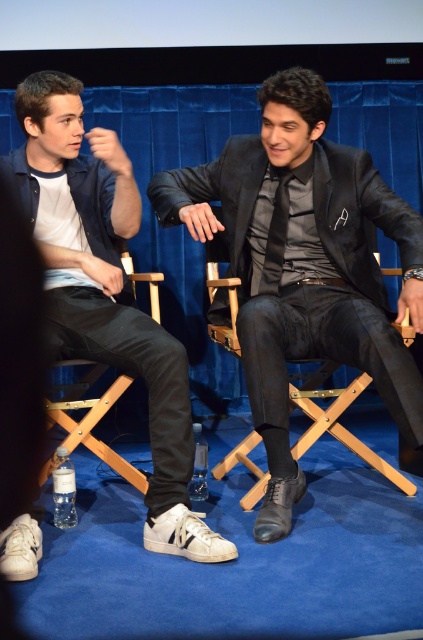
Between black leather shoes at center and silky black tie at center, which one appears on the left side from the viewer's perspective?

From the viewer's perspective, silky black tie at center appears more on the left side.

What do you see at coordinates (304, 268) in the screenshot? The height and width of the screenshot is (640, 423). I see `black leather shoes at center` at bounding box center [304, 268].

Locate an element on the screen. The height and width of the screenshot is (640, 423). black leather shoes at center is located at coordinates (304, 268).

Who is positioned more to the right, black leather folding chair at center or wooden folding chair at lower left?

Positioned to the right is black leather folding chair at center.

Who is higher up, black leather folding chair at center or wooden folding chair at lower left?

black leather folding chair at center

Is point (370, 378) less distant than point (65, 419)?

No, it is behind (65, 419).

You are a GUI agent. You are given a task and a screenshot of the screen. Output one action in this format:
    pyautogui.click(x=<x>, y=<y>)
    Task: Click on the black leather folding chair at center
    The width and height of the screenshot is (423, 640).
    Given the screenshot: What is the action you would take?
    pyautogui.click(x=337, y=419)

Based on the photo, does black leather shoes at center appear on the right side of black leather folding chair at center?

No, black leather shoes at center is not to the right of black leather folding chair at center.

Is black leather shoes at center shorter than black leather folding chair at center?

No, black leather shoes at center is not shorter than black leather folding chair at center.

Where is `black leather shoes at center`? The width and height of the screenshot is (423, 640). black leather shoes at center is located at coordinates pyautogui.click(x=304, y=268).